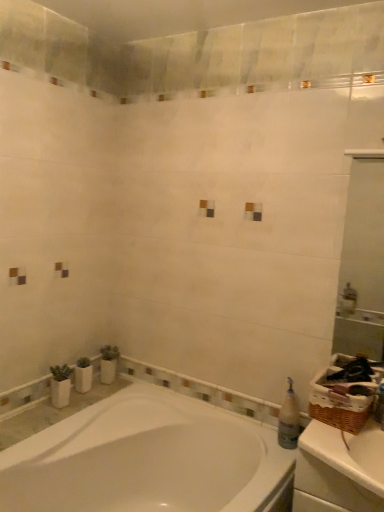
Question: Is white glossy bathtub at lower left completely or partially outside of white matte counter top at right?

Choices:
 (A) yes
 (B) no

Answer: (A)

Question: Is white glossy bathtub at lower left facing towards white matte counter top at right?

Choices:
 (A) no
 (B) yes

Answer: (A)

Question: Considering the relative sizes of white glossy bathtub at lower left and white matte counter top at right in the image provided, is white glossy bathtub at lower left smaller than white matte counter top at right?

Choices:
 (A) no
 (B) yes

Answer: (A)

Question: Does white glossy bathtub at lower left touch white matte counter top at right?

Choices:
 (A) no
 (B) yes

Answer: (A)

Question: Is white glossy bathtub at lower left looking in the opposite direction of white matte counter top at right?

Choices:
 (A) yes
 (B) no

Answer: (B)

Question: Is translucent plastic bottle at right inside the boundaries of white glossy bathtub at lower left, or outside?

Choices:
 (A) outside
 (B) inside

Answer: (A)

Question: Considering the relative positions of translucent plastic bottle at right and white glossy bathtub at lower left in the image provided, is translucent plastic bottle at right to the left or to the right of white glossy bathtub at lower left?

Choices:
 (A) right
 (B) left

Answer: (A)

Question: Is translucent plastic bottle at right wider or thinner than white glossy bathtub at lower left?

Choices:
 (A) thin
 (B) wide

Answer: (A)

Question: Based on their sizes in the image, would you say translucent plastic bottle at right is bigger or smaller than white glossy bathtub at lower left?

Choices:
 (A) big
 (B) small

Answer: (B)

Question: From a real-world perspective, is white matte counter top at right physically located above or below translucent plastic bottle at right?

Choices:
 (A) above
 (B) below

Answer: (B)

Question: Relative to translucent plastic bottle at right, is white matte counter top at right in front or behind?

Choices:
 (A) behind
 (B) front

Answer: (B)

Question: From the image's perspective, is white matte counter top at right above or below translucent plastic bottle at right?

Choices:
 (A) above
 (B) below

Answer: (B)

Question: Is white matte counter top at right spatially inside translucent plastic bottle at right, or outside of it?

Choices:
 (A) outside
 (B) inside

Answer: (A)

Question: Do you think white glossy mirror at upper right is within translucent plastic bottle at right, or outside of it?

Choices:
 (A) outside
 (B) inside

Answer: (A)

Question: Is point (337, 349) positioned closer to the camera than point (296, 408)?

Choices:
 (A) farther
 (B) closer

Answer: (A)